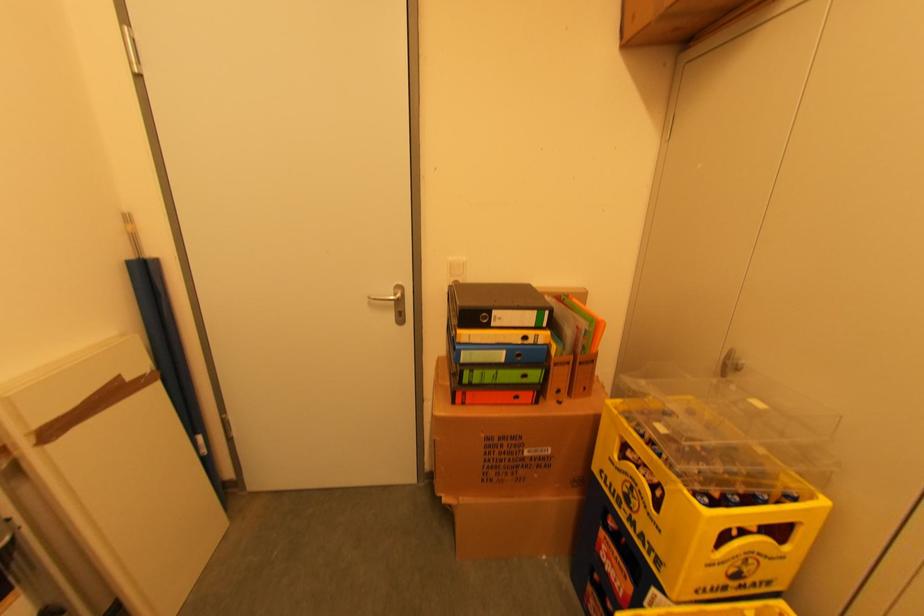
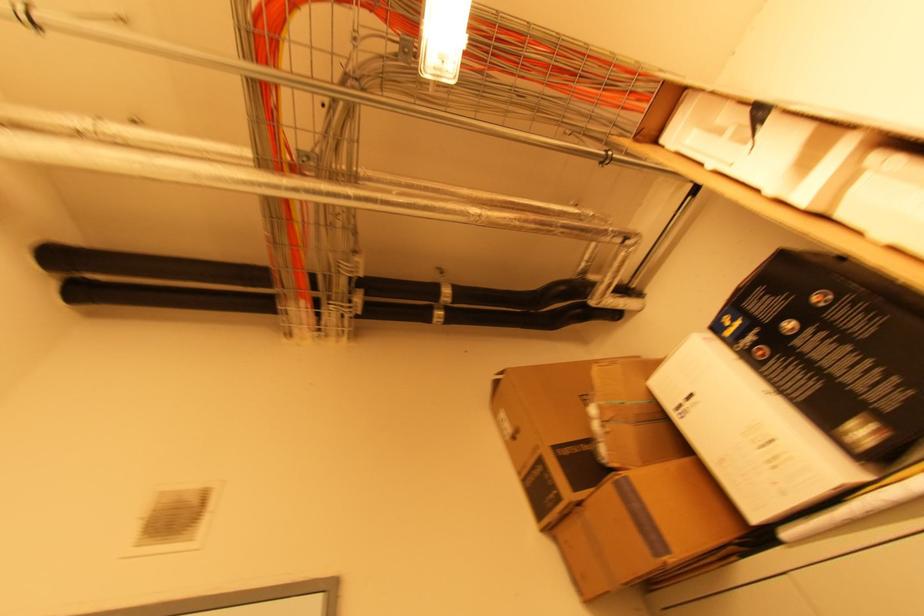
In the scene shown: First-person continuous shooting, in which direction is the camera rotating?

The rotation direction of the camera is right-up.